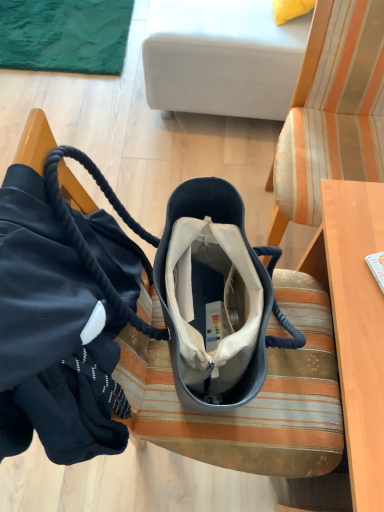
Question: Should I look upward or downward to see striped fabric chair at center?

Choices:
 (A) up
 (B) down

Answer: (A)

Question: Is striped fabric chair at center next to white fabric studio couch at upper center and touching it?

Choices:
 (A) yes
 (B) no

Answer: (B)

Question: Considering the relative positions of striped fabric chair at center and white fabric studio couch at upper center in the image provided, is striped fabric chair at center to the right of white fabric studio couch at upper center from the viewer's perspective?

Choices:
 (A) yes
 (B) no

Answer: (A)

Question: Can you confirm if striped fabric chair at center is smaller than white fabric studio couch at upper center?

Choices:
 (A) yes
 (B) no

Answer: (A)

Question: Considering the relative sizes of striped fabric chair at center and white fabric studio couch at upper center in the image provided, is striped fabric chair at center taller than white fabric studio couch at upper center?

Choices:
 (A) no
 (B) yes

Answer: (B)

Question: From the image's perspective, is striped fabric chair at center below white fabric studio couch at upper center?

Choices:
 (A) no
 (B) yes

Answer: (B)

Question: Is striped fabric chair at center closer to camera compared to white fabric studio couch at upper center?

Choices:
 (A) yes
 (B) no

Answer: (A)

Question: Is velvet bag at center turned away from white fabric studio couch at upper center?

Choices:
 (A) no
 (B) yes

Answer: (A)

Question: Is velvet bag at center bigger than white fabric studio couch at upper center?

Choices:
 (A) yes
 (B) no

Answer: (B)

Question: Does velvet bag at center have a greater width compared to white fabric studio couch at upper center?

Choices:
 (A) no
 (B) yes

Answer: (A)

Question: Is velvet bag at center shorter than white fabric studio couch at upper center?

Choices:
 (A) yes
 (B) no

Answer: (B)

Question: From the image's perspective, is velvet bag at center below white fabric studio couch at upper center?

Choices:
 (A) yes
 (B) no

Answer: (A)

Question: Is velvet bag at center taller than white fabric studio couch at upper center?

Choices:
 (A) no
 (B) yes

Answer: (B)

Question: From the image's perspective, is striped fabric chair at center above velvet bag at center?

Choices:
 (A) no
 (B) yes

Answer: (B)